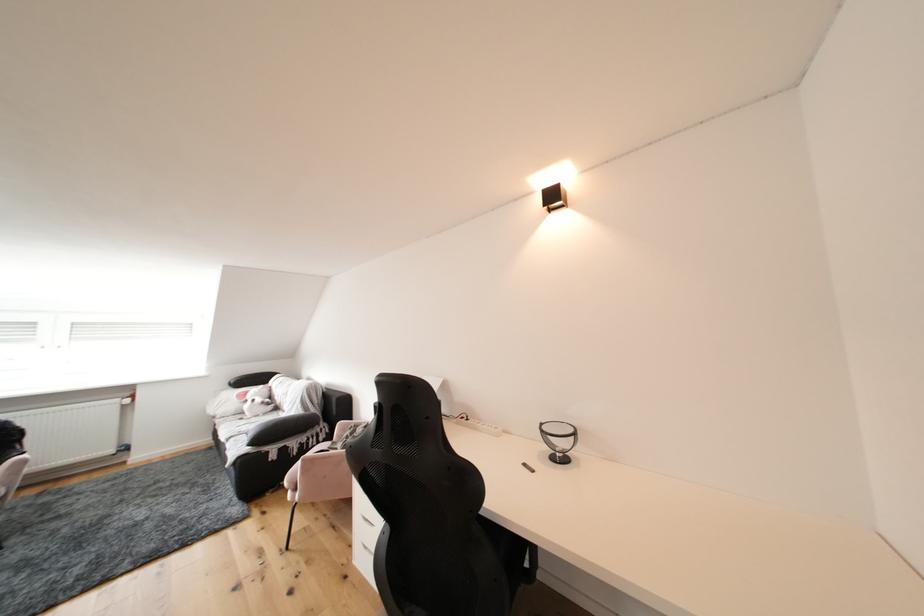
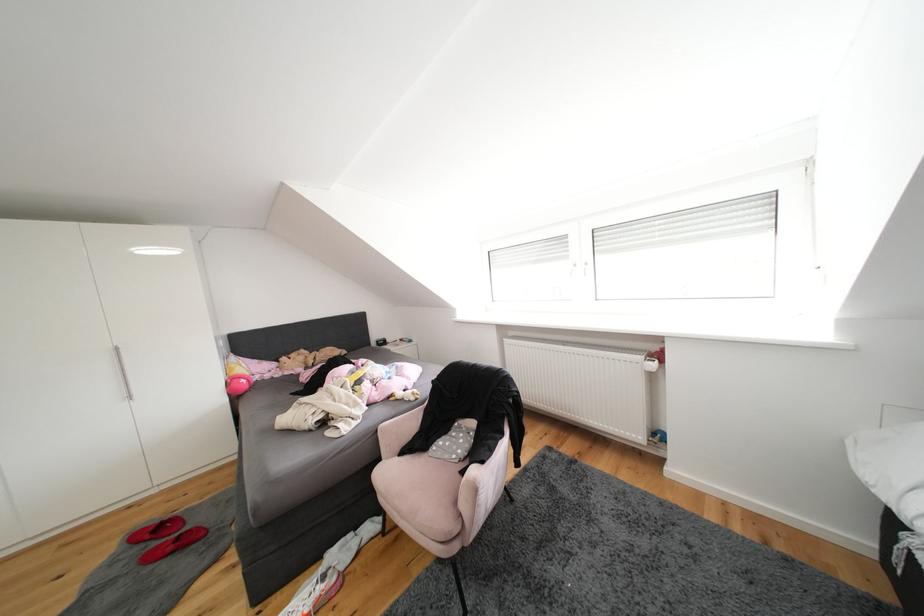
The point at (219, 416) is marked in the first image. Where is the corresponding point in the second image?

(874, 479)